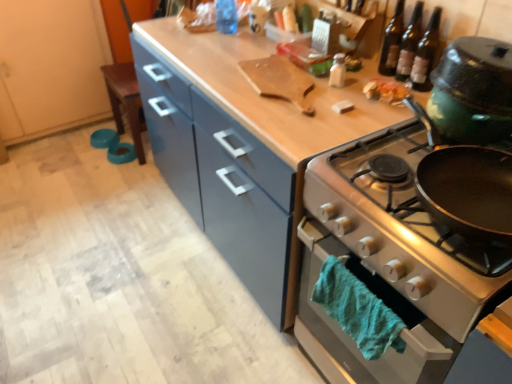
Identify the location of vacant space to the left of translucent glass bottles at upper right, which is counted as the 1th beer bottle, starting from the right. (354, 94).